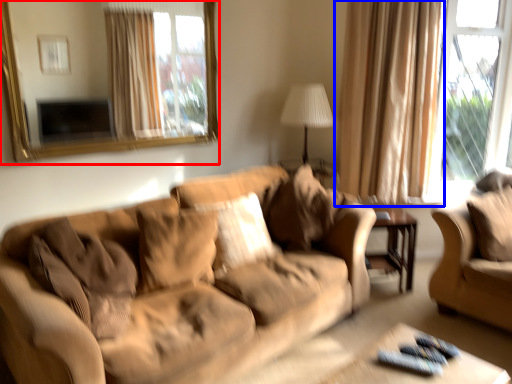
Question: Which of the following is the closest to the observer, mirror (highlighted by a red box) or curtain (highlighted by a blue box)?

Choices:
 (A) mirror
 (B) curtain

Answer: (A)